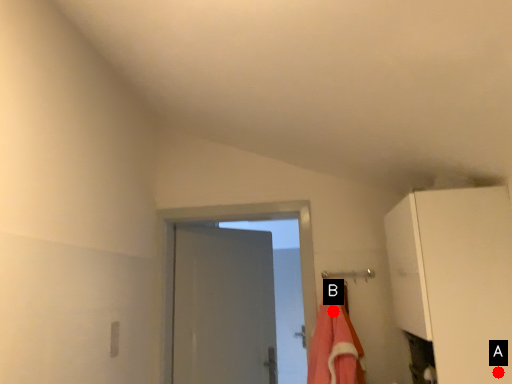
Question: Two points are circled on the image, labeled by A and B beside each circle. Which point is farther to the camera?

Choices:
 (A) A is further
 (B) B is further

Answer: (B)